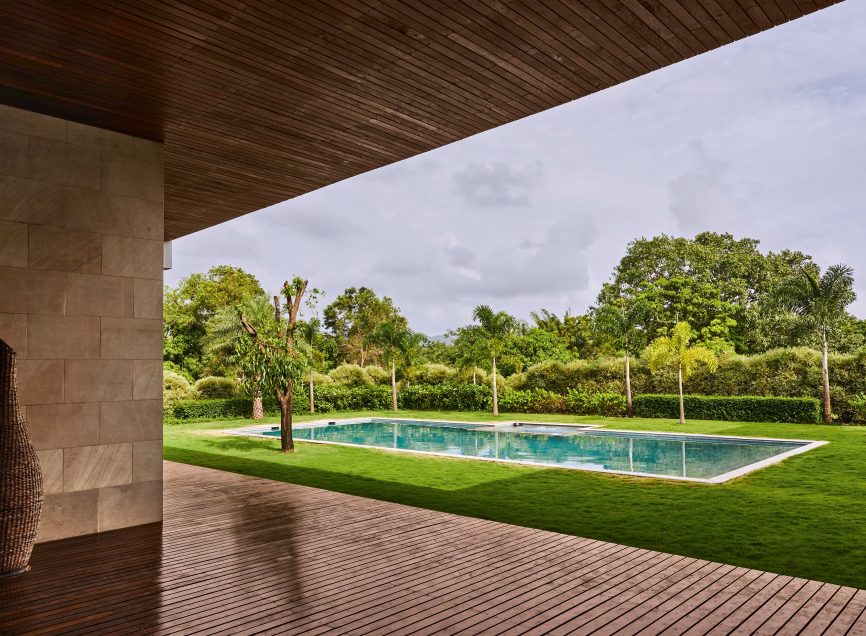
Where is `tall basket`? This screenshot has width=866, height=636. tall basket is located at coordinates (24, 495).